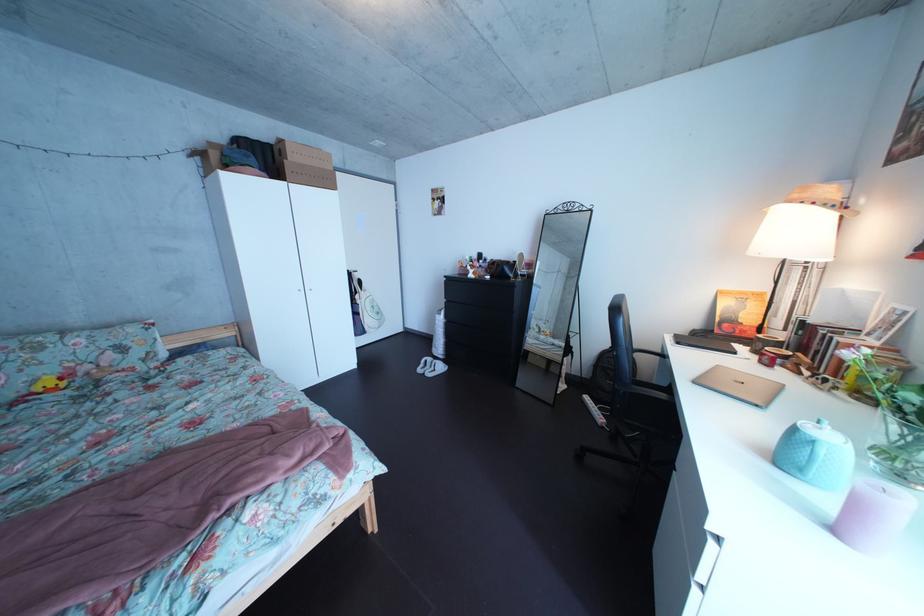
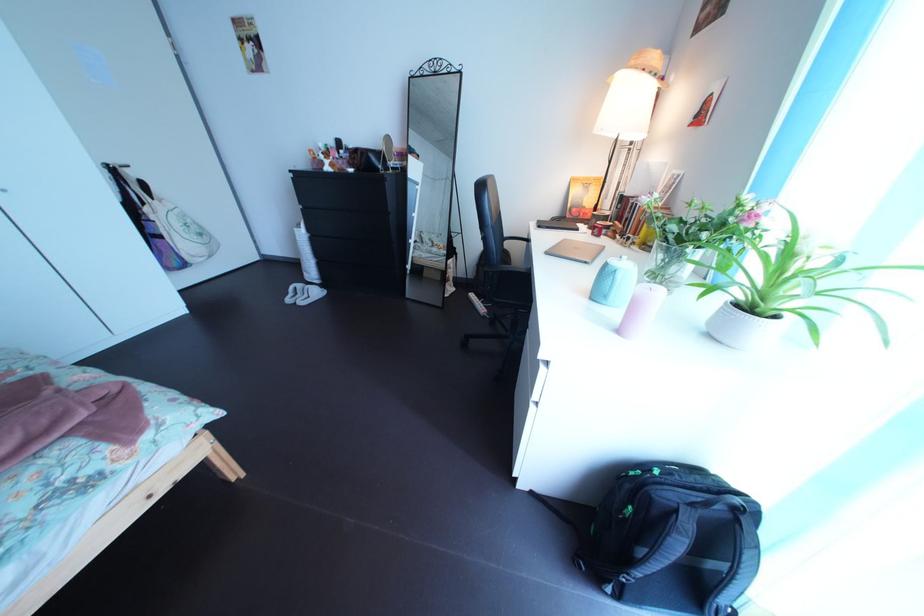
The images are taken continuously from a first-person perspective. In which direction are you moving?

The movement direction of the cameraman is right, forward.